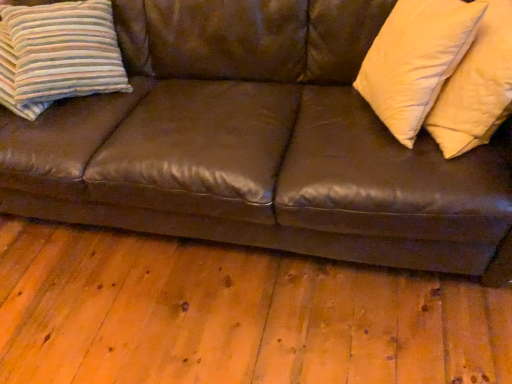
Measure the distance between point (x=435, y=10) and camera.

Point (x=435, y=10) and camera are 3.69 feet apart from each other.

In order to face soft yellow pillow at right, the third pillow from the left, should I rotate leftwards or rightwards?

A 27.317 degree turn to the right will do.

The width and height of the screenshot is (512, 384). In order to click on soft yellow pillow at right, the third pillow from the left in this screenshot , I will do `click(476, 86)`.

This screenshot has height=384, width=512. Identify the location of soft cream pillow at right, placed as the second pillow when sorted from right to left. (416, 60).

Do you think soft yellow pillow at right, which is counted as the 1th pillow, starting from the right, is within striped fabric pillow at left, acting as the third pillow starting from the right, or outside of it?

soft yellow pillow at right, which is counted as the 1th pillow, starting from the right, is outside striped fabric pillow at left, acting as the third pillow starting from the right.

What's the angular difference between soft yellow pillow at right, which is counted as the 1th pillow, starting from the right, and striped fabric pillow at left, acting as the third pillow starting from the right,'s facing directions?

There is a 148-degree angle between the facing directions of soft yellow pillow at right, which is counted as the 1th pillow, starting from the right, and striped fabric pillow at left, acting as the third pillow starting from the right.

Which of these two, soft yellow pillow at right, which is counted as the 1th pillow, starting from the right, or striped fabric pillow at left, acting as the third pillow starting from the right, is smaller?

striped fabric pillow at left, acting as the third pillow starting from the right.

Considering the positions of objects soft yellow pillow at right, which is counted as the 1th pillow, starting from the right, and striped fabric pillow at left, which ranks as the 1th pillow in left-to-right order, in the image provided, who is more to the left, soft yellow pillow at right, which is counted as the 1th pillow, starting from the right, or striped fabric pillow at left, which ranks as the 1th pillow in left-to-right order,?

From the viewer's perspective, striped fabric pillow at left, which ranks as the 1th pillow in left-to-right order, appears more on the left side.

Is soft cream pillow at right, which is the second pillow in left-to-right order, oriented towards striped fabric pillow at left, acting as the third pillow starting from the right?

→ Yes, soft cream pillow at right, which is the second pillow in left-to-right order, is aimed at striped fabric pillow at left, acting as the third pillow starting from the right.

Is point (436, 36) more distant than point (50, 53)?

That is False.

Is soft cream pillow at right, which is the second pillow in left-to-right order, not near striped fabric pillow at left, which ranks as the 1th pillow in left-to-right order?

Yes, soft cream pillow at right, which is the second pillow in left-to-right order, and striped fabric pillow at left, which ranks as the 1th pillow in left-to-right order, are quite far apart.

From a real-world perspective, is soft cream pillow at right, placed as the second pillow when sorted from right to left, positioned over striped fabric pillow at left, acting as the third pillow starting from the right, based on gravity?

Yes, from a real-world perspective, soft cream pillow at right, placed as the second pillow when sorted from right to left, is on top of striped fabric pillow at left, acting as the third pillow starting from the right.

Is point (445, 154) farther from camera compared to point (158, 29)?

No, (445, 154) is in front of (158, 29).

Can we say soft yellow pillow at right, which is counted as the 1th pillow, starting from the right, lies outside brown leather couch at center?

That's incorrect, soft yellow pillow at right, which is counted as the 1th pillow, starting from the right, is not completely outside brown leather couch at center.

Between soft yellow pillow at right, the third pillow from the left, and brown leather couch at center, which one appears on the left side from the viewer's perspective?

Positioned to the left is brown leather couch at center.

Between striped fabric pillow at left, acting as the third pillow starting from the right, and soft cream pillow at right, placed as the second pillow when sorted from right to left, which one has smaller size?

With smaller size is soft cream pillow at right, placed as the second pillow when sorted from right to left.

Considering the sizes of objects striped fabric pillow at left, acting as the third pillow starting from the right, and soft cream pillow at right, which is the second pillow in left-to-right order, in the image provided, who is thinner, striped fabric pillow at left, acting as the third pillow starting from the right, or soft cream pillow at right, which is the second pillow in left-to-right order,?

soft cream pillow at right, which is the second pillow in left-to-right order.

Considering the relative positions of striped fabric pillow at left, which ranks as the 1th pillow in left-to-right order, and soft cream pillow at right, placed as the second pillow when sorted from right to left, in the image provided, is striped fabric pillow at left, which ranks as the 1th pillow in left-to-right order, to the right of soft cream pillow at right, placed as the second pillow when sorted from right to left, from the viewer's perspective?

No, striped fabric pillow at left, which ranks as the 1th pillow in left-to-right order, is not to the right of soft cream pillow at right, placed as the second pillow when sorted from right to left.

Is brown leather couch at center aimed at soft cream pillow at right, placed as the second pillow when sorted from right to left?

Yes, brown leather couch at center is oriented towards soft cream pillow at right, placed as the second pillow when sorted from right to left.

Is point (362, 124) positioned behind point (382, 36)?

Yes, it is behind point (382, 36).

Can soft cream pillow at right, which is the second pillow in left-to-right order, be found inside brown leather couch at center?

Yes, soft cream pillow at right, which is the second pillow in left-to-right order, is a part of brown leather couch at center.

Find the location of a particular element. The width and height of the screenshot is (512, 384). the 3rd pillow behind the brown leather couch at center is located at coordinates (58, 54).

Is striped fabric pillow at left, acting as the third pillow starting from the right, at the back of brown leather couch at center?

Yes, brown leather couch at center is facing away from striped fabric pillow at left, acting as the third pillow starting from the right.

From the image's perspective, does brown leather couch at center appear higher than striped fabric pillow at left, acting as the third pillow starting from the right?

No.

Does soft cream pillow at right, which is the second pillow in left-to-right order, lie behind soft yellow pillow at right, which is counted as the 1th pillow, starting from the right?

Yes, soft cream pillow at right, which is the second pillow in left-to-right order, is behind soft yellow pillow at right, which is counted as the 1th pillow, starting from the right.

Is point (443, 57) positioned before point (445, 86)?

That is True.

From a real-world perspective, who is located higher, soft cream pillow at right, placed as the second pillow when sorted from right to left, or soft yellow pillow at right, which is counted as the 1th pillow, starting from the right?

soft cream pillow at right, placed as the second pillow when sorted from right to left, from a real-world perspective.

From a real-world perspective, count 1st pillows upward from the striped fabric pillow at left, which ranks as the 1th pillow in left-to-right order, and point to it. Please provide its 2D coordinates.

[(476, 86)]

At what (x,y) coordinates should I click in order to perform the action: click on the 1st pillow below the striped fabric pillow at left, acting as the third pillow starting from the right (from the image's perspective). Please return your answer as a coordinate pair (x, y). The width and height of the screenshot is (512, 384). Looking at the image, I should click on (416, 60).

Estimate the real-world distances between objects in this image. Which object is further from striped fabric pillow at left, which ranks as the 1th pillow in left-to-right order, brown leather couch at center or soft yellow pillow at right, which is counted as the 1th pillow, starting from the right?

soft yellow pillow at right, which is counted as the 1th pillow, starting from the right, lies further to striped fabric pillow at left, which ranks as the 1th pillow in left-to-right order, than the other object.

From the image, which object appears to be nearer to soft yellow pillow at right, which is counted as the 1th pillow, starting from the right, brown leather couch at center or striped fabric pillow at left, acting as the third pillow starting from the right?

The object closer to soft yellow pillow at right, which is counted as the 1th pillow, starting from the right, is brown leather couch at center.

Considering their positions, is soft cream pillow at right, placed as the second pillow when sorted from right to left, positioned closer to brown leather couch at center than striped fabric pillow at left, acting as the third pillow starting from the right?

soft cream pillow at right, placed as the second pillow when sorted from right to left, is positioned closer to the anchor brown leather couch at center.

When comparing their distances from brown leather couch at center, does soft cream pillow at right, which is the second pillow in left-to-right order, or soft yellow pillow at right, which is counted as the 1th pillow, starting from the right, seem further?

Based on the image, soft yellow pillow at right, which is counted as the 1th pillow, starting from the right, appears to be further to brown leather couch at center.

In the scene shown: Considering their positions, is soft yellow pillow at right, which is counted as the 1th pillow, starting from the right, positioned closer to brown leather couch at center than striped fabric pillow at left, acting as the third pillow starting from the right?

striped fabric pillow at left, acting as the third pillow starting from the right, is positioned closer to the anchor brown leather couch at center.

From the image, which object appears to be nearer to brown leather couch at center, soft yellow pillow at right, which is counted as the 1th pillow, starting from the right, or soft cream pillow at right, placed as the second pillow when sorted from right to left?

soft cream pillow at right, placed as the second pillow when sorted from right to left, is positioned closer to the anchor brown leather couch at center.

Looking at the image, which one is located further to striped fabric pillow at left, acting as the third pillow starting from the right, brown leather couch at center or soft cream pillow at right, which is the second pillow in left-to-right order?

The object further to striped fabric pillow at left, acting as the third pillow starting from the right, is soft cream pillow at right, which is the second pillow in left-to-right order.

Estimate the real-world distances between objects in this image. Which object is closer to soft yellow pillow at right, the third pillow from the left, brown leather couch at center or soft cream pillow at right, placed as the second pillow when sorted from right to left?

soft cream pillow at right, placed as the second pillow when sorted from right to left, is positioned closer to the anchor soft yellow pillow at right, the third pillow from the left.

Where is `studio couch located between striped fabric pillow at left, which ranks as the 1th pillow in left-to-right order, and soft cream pillow at right, which is the second pillow in left-to-right order, in the left-right direction`? The image size is (512, 384). studio couch located between striped fabric pillow at left, which ranks as the 1th pillow in left-to-right order, and soft cream pillow at right, which is the second pillow in left-to-right order, in the left-right direction is located at coordinates (x=259, y=144).

Where is `pillow between brown leather couch at center and soft yellow pillow at right, which is counted as the 1th pillow, starting from the right`? pillow between brown leather couch at center and soft yellow pillow at right, which is counted as the 1th pillow, starting from the right is located at coordinates (416, 60).

The height and width of the screenshot is (384, 512). I want to click on studio couch located between striped fabric pillow at left, which ranks as the 1th pillow in left-to-right order, and soft yellow pillow at right, which is counted as the 1th pillow, starting from the right, in the left-right direction, so click(259, 144).

You are a GUI agent. You are given a task and a screenshot of the screen. Output one action in this format:
    pyautogui.click(x=<x>, y=<y>)
    Task: Click on the pillow situated between striped fabric pillow at left, acting as the third pillow starting from the right, and soft yellow pillow at right, the third pillow from the left, from left to right
    
    Given the screenshot: What is the action you would take?
    pyautogui.click(x=416, y=60)